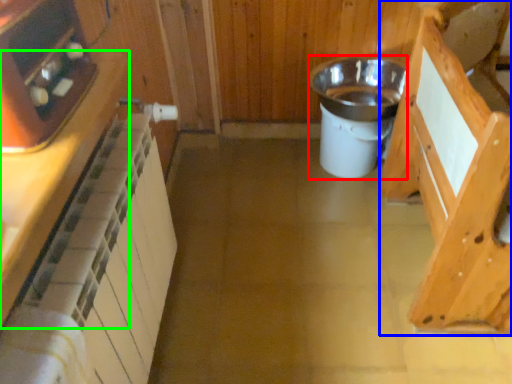
Question: Estimate the real-world distances between objects in this image. Which object is closer to appliance (highlighted by a red box), cabinetry (highlighted by a blue box) or cabinetry (highlighted by a green box)?

Choices:
 (A) cabinetry
 (B) cabinetry

Answer: (A)